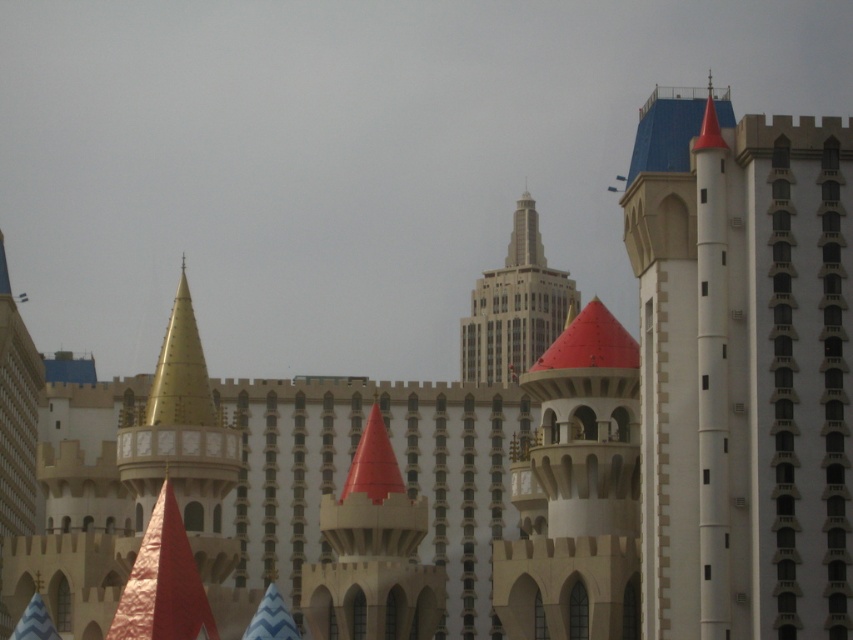
Question: Does white stone tower at upper right appear over smooth white tower at center?

Choices:
 (A) yes
 (B) no

Answer: (A)

Question: Which point is farther to the camera?

Choices:
 (A) (518, 241)
 (B) (512, 499)

Answer: (A)

Question: Which point is farther from the camera taking this photo?

Choices:
 (A) (163, 397)
 (B) (547, 428)
 (C) (537, 236)

Answer: (C)

Question: Can you confirm if white stone tower at upper right is positioned above smooth gray skyscraper at center?

Choices:
 (A) yes
 (B) no

Answer: (B)

Question: Which object is the closest to the matte gold cone at center?

Choices:
 (A) smooth beige tower at center
 (B) gold metallic spire at center
 (C) smooth gray skyscraper at center
 (D) smooth white tower at center

Answer: (D)

Question: From the image, what is the correct spatial relationship of matte gold cone at center in relation to smooth beige tower at center?

Choices:
 (A) above
 (B) below

Answer: (B)